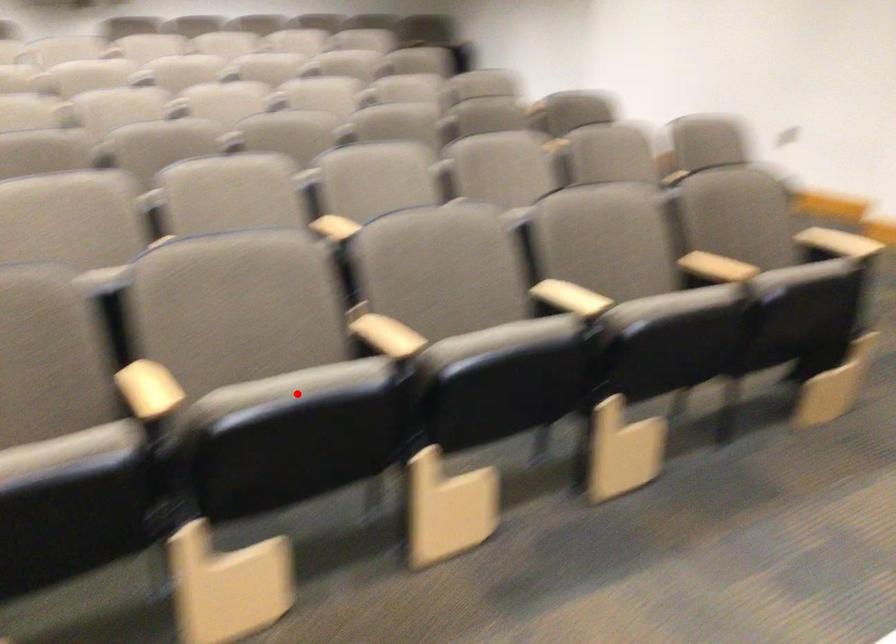
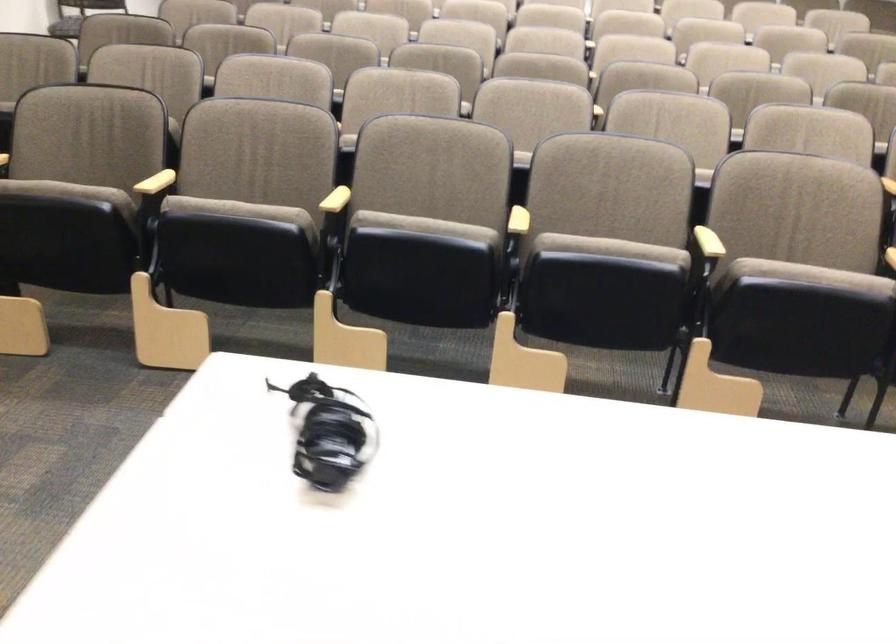
Question: I am providing you with two images of the same scene from different viewpoints. Given a red point in image1, look at the same physical point in image2. Is it:

Choices:
 (A) Closer to the viewpoint
 (B) Farther from the viewpoint

Answer: (B)